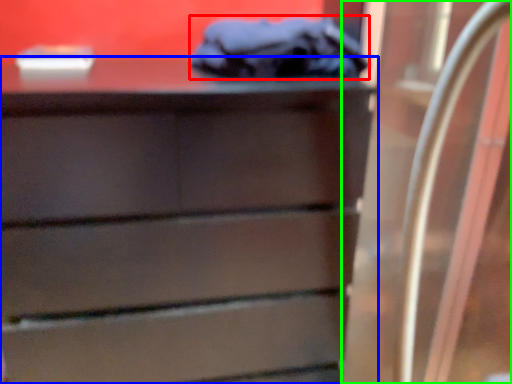
Question: Which is farther away from scrub (highlighted by a red box)? chest of drawers (highlighted by a blue box) or glass door (highlighted by a green box)?

Choices:
 (A) chest of drawers
 (B) glass door

Answer: (B)